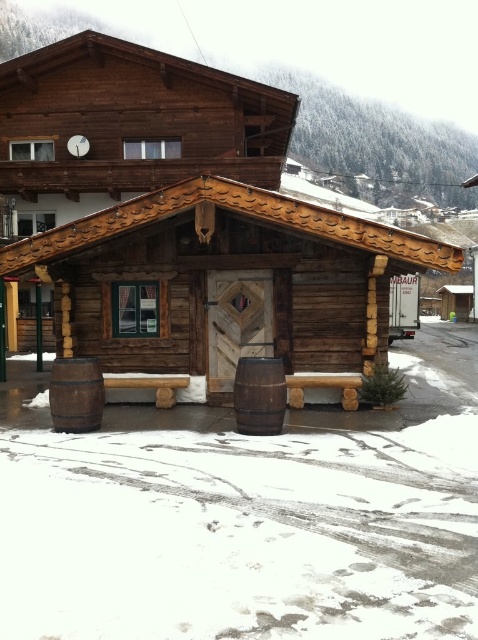
Question: Which point is closer to the camera?

Choices:
 (A) wooden cabin at center
 (B) brown wooden barrel at lower center

Answer: (B)

Question: Is the position of wooden cabin at center more distant than that of brown wooden barrel at lower left?

Choices:
 (A) yes
 (B) no

Answer: (A)

Question: Among these objects, which one is nearest to the camera?

Choices:
 (A) brown wooden barrel at lower left
 (B) wooden cabin at center
 (C) brown wooden barrel at lower center

Answer: (C)

Question: Is wooden cabin at center further to camera compared to brown wooden barrel at lower left?

Choices:
 (A) yes
 (B) no

Answer: (A)

Question: Can you confirm if wooden cabin at center is thinner than brown wooden barrel at lower center?

Choices:
 (A) no
 (B) yes

Answer: (A)

Question: Among these points, which one is nearest to the camera?

Choices:
 (A) (140, 362)
 (B) (69, 422)

Answer: (B)